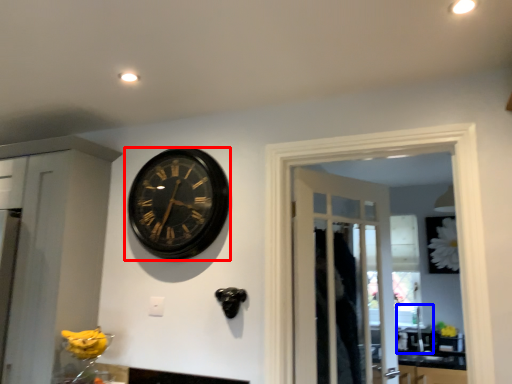
Question: Which point is further to the camera, wall clock (highlighted by a red box) or sink (highlighted by a blue box)?

Choices:
 (A) wall clock
 (B) sink

Answer: (B)